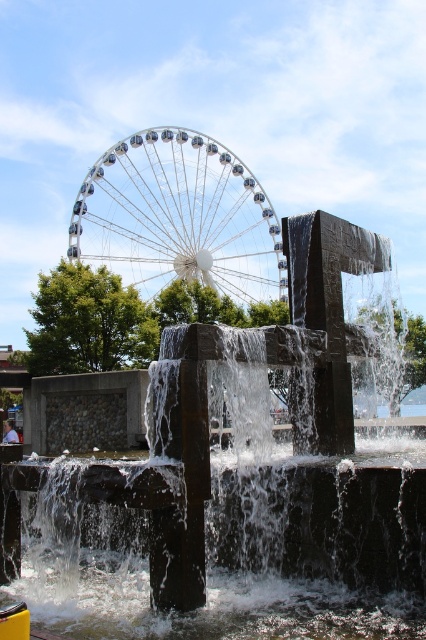
Consider the image. You are standing in the outdoor area and want to take a photo of both the clear water at center and the shiny metallic ferris wheel at upper center. Which object should you position to the left side of your camera frame to include both in the photo?

You should position the shiny metallic ferris wheel at upper center to the left side of your camera frame because the clear water at center is to the right of it, ensuring both are included in the photo.

You are designing a layout for a new park and want to place a statue between the clear water at center and the shiny metallic ferris wheel at upper center. Given their relative sizes, which object should the statue be closer to?

The clear water at center is thinner than the shiny metallic ferris wheel at upper center, so the statue should be placed closer to the ferris wheel to maintain visual balance.

You are standing at the center of the fountain and want to locate the clear water at center. According to the coordinates provided, where exactly should you look?

The clear water at center is located at coordinates point (244, 552).